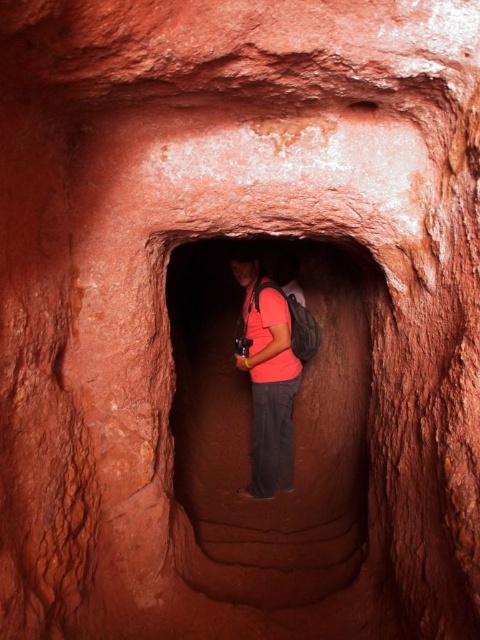
Question: Which point appears closest to the camera in this image?

Choices:
 (A) (273, 532)
 (B) (288, 397)

Answer: (A)

Question: Is matte red rock at center thinner than matte pink shirt at center?

Choices:
 (A) yes
 (B) no

Answer: (B)

Question: Can you confirm if matte red rock at center is positioned to the right of matte pink shirt at center?

Choices:
 (A) no
 (B) yes

Answer: (B)

Question: Where is matte red rock at center located in relation to matte pink shirt at center in the image?

Choices:
 (A) above
 (B) below

Answer: (A)